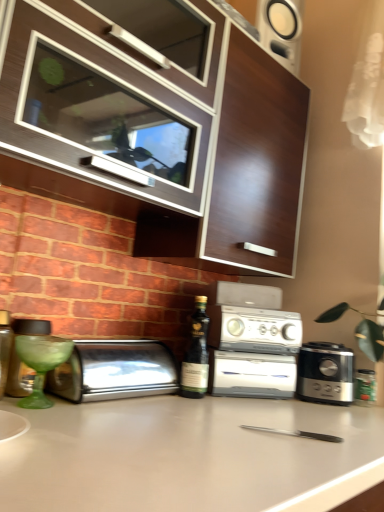
You are a GUI agent. You are given a task and a screenshot of the screen. Output one action in this format:
    pyautogui.click(x=<x>, y=<y>)
    Task: Click on the free space in front of satin silver toaster at lower left
    
    Given the screenshot: What is the action you would take?
    pyautogui.click(x=110, y=414)